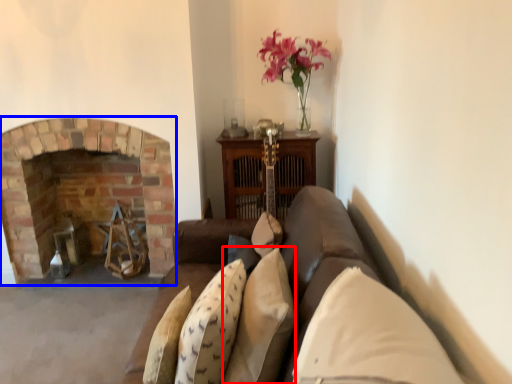
Question: Which point is further to the camera, pillow (highlighted by a red box) or fireplace (highlighted by a blue box)?

Choices:
 (A) pillow
 (B) fireplace

Answer: (B)